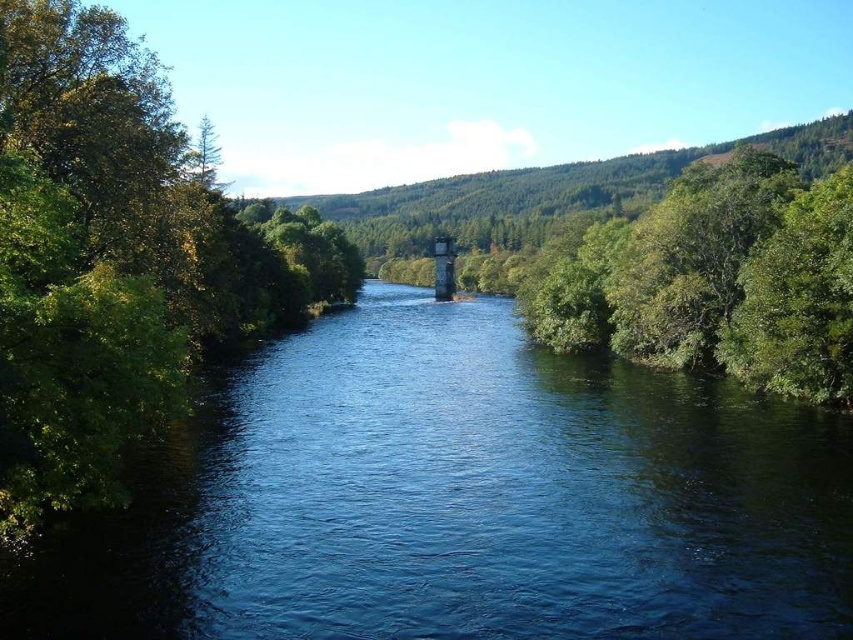
Question: Does blue smooth water at center have a greater width compared to green leafy tree at left?

Choices:
 (A) no
 (B) yes

Answer: (B)

Question: Can you confirm if blue smooth water at center is thinner than green leafy tree at left?

Choices:
 (A) no
 (B) yes

Answer: (A)

Question: Where is blue smooth water at center located in relation to green leafy tree at left in the image?

Choices:
 (A) above
 (B) below

Answer: (B)

Question: Among these points, which one is farthest from the camera?

Choices:
 (A) [x=799, y=486]
 (B) [x=13, y=305]

Answer: (A)

Question: Which point appears closest to the camera in this image?

Choices:
 (A) (172, 408)
 (B) (509, 611)

Answer: (B)